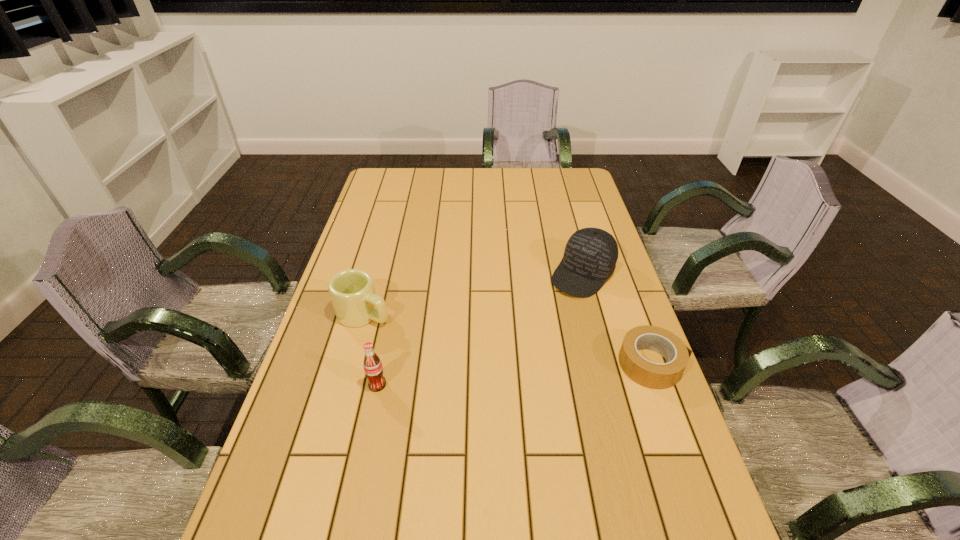
In order to click on free space located at the front of the baseball cap where the brim is located in this screenshot , I will do 501,366.

The width and height of the screenshot is (960, 540). In order to click on vacant space located 0.140m at the front of the baseball cap where the brim is located in this screenshot , I will do `click(542, 320)`.

Where is `object present at the left edge`? The width and height of the screenshot is (960, 540). object present at the left edge is located at coordinates (352, 292).

I want to click on duct tape situated at the right edge, so click(652, 375).

Image resolution: width=960 pixels, height=540 pixels. Find the location of `baseball cap present at the right edge`. baseball cap present at the right edge is located at coordinates (590, 257).

The image size is (960, 540). In the image, there is a desktop. What are the coordinates of `free region at the far edge` in the screenshot? It's located at (478, 173).

Identify the location of vacant space at the near edge. The image size is (960, 540). (370, 513).

Where is `vacant space at the left edge of the desktop`? vacant space at the left edge of the desktop is located at coordinates (387, 234).

Find the location of a particular element. The image size is (960, 540). vacant area at the right edge is located at coordinates (600, 319).

In the image, there is a desktop. Find the location of `vacant space at the far left corner`. vacant space at the far left corner is located at coordinates (403, 184).